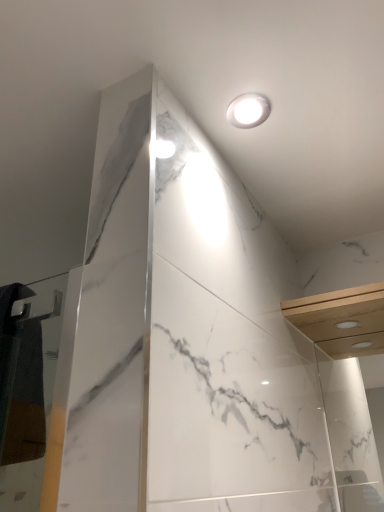
What do you see at coordinates (248, 110) in the screenshot? The image size is (384, 512). I see `white glossy light fixture at upper center` at bounding box center [248, 110].

What is the approximate height of white glossy light fixture at upper center?

white glossy light fixture at upper center is 0.95 inches in height.

What are the coordinates of `white glossy light fixture at upper center` in the screenshot? It's located at (248, 110).

You are a GUI agent. You are given a task and a screenshot of the screen. Output one action in this format:
    pyautogui.click(x=<x>, y=<y>)
    Task: Click on the white glossy light fixture at upper center
    
    Given the screenshot: What is the action you would take?
    pyautogui.click(x=248, y=110)